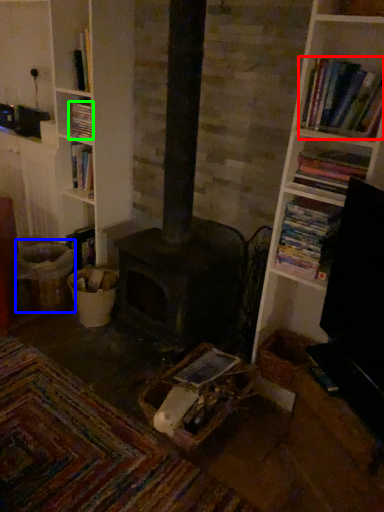
Question: Which is farther away from book (highlighted by a red box)? basket (highlighted by a blue box) or book (highlighted by a green box)?

Choices:
 (A) basket
 (B) book

Answer: (A)